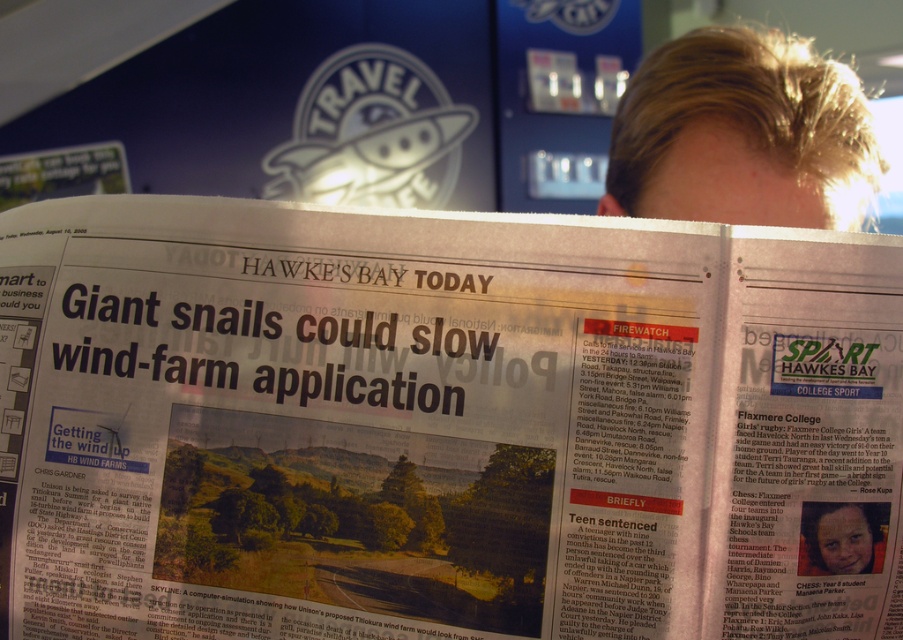
You are a photographer standing at a distance. You want to take a closeup shot of the headline on the white glossy newspaper at center. Considering the newspaper is 15.70 inches away from the camera, can you adjust your camera to focus on the headline without moving closer?

The white glossy newspaper at center is 15.70 inches away from the camera. Since cameras can adjust focus at various distances, you can focus on the headline without moving closer by adjusting the camera settings.

You are a delivery robot that needs to place a package on the white glossy newspaper at center without hitting the blonde hair at upper right. The package is 50 centimeters wide. Can you safely place the package there?

The distance between the white glossy newspaper at center and the blonde hair at upper right is 68.05 centimeters. Since the package is 50 centimeters wide, there is enough space to safely place it without hitting the blonde hair at upper right.